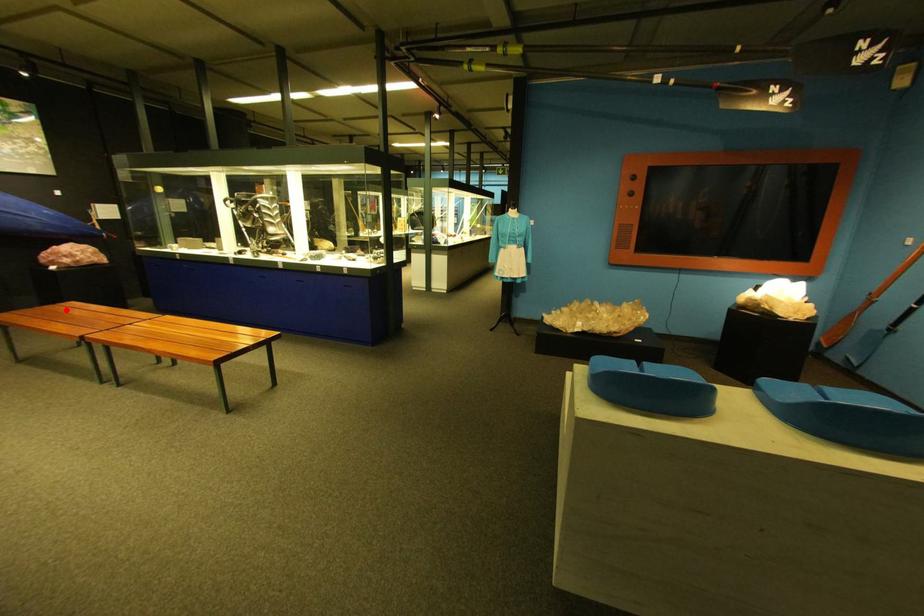
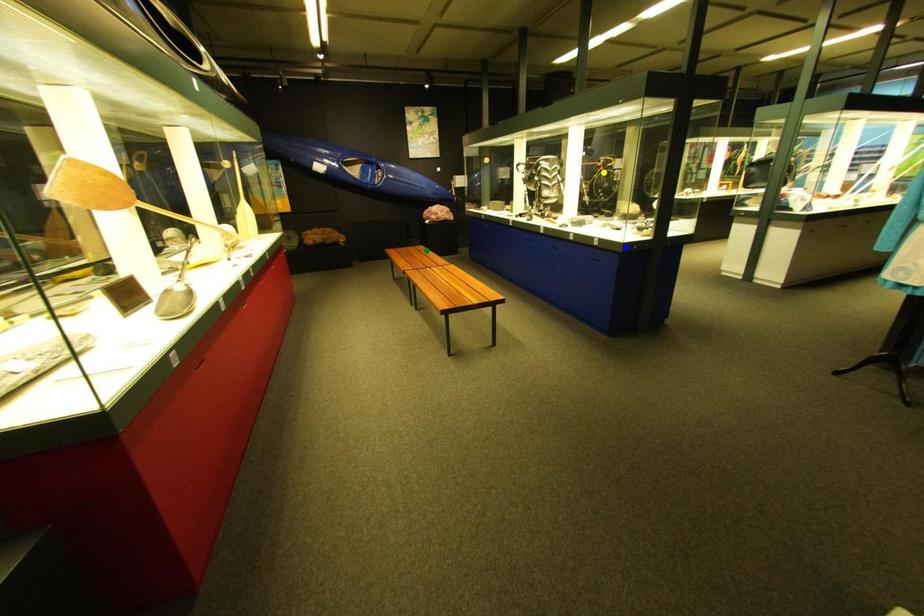
Question: I am providing you with two images of the same scene from different viewpoints. A red point is marked on the first image. You are given multiple points on the second image. Which spot in image 2 lines up with the point in image 1?

Choices:
 (A) blue point
 (B) green point
 (C) yellow point

Answer: (B)